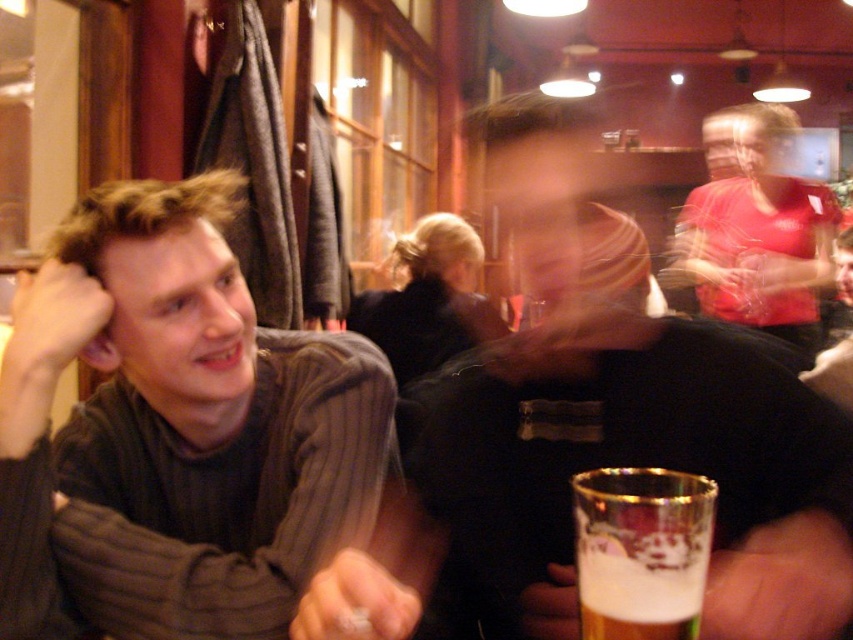
Question: Does black matte shirt at center appear on the left side of foamy glass at lower center?

Choices:
 (A) yes
 (B) no

Answer: (A)

Question: Which object is the closest to the foamy glass at lower center?

Choices:
 (A) dark gray ribbed sweater at left
 (B) matte red shirt at upper right

Answer: (A)

Question: Does dark gray ribbed sweater at left appear on the left side of matte red shirt at upper right?

Choices:
 (A) no
 (B) yes

Answer: (B)

Question: Which object appears farthest from the camera in this image?

Choices:
 (A) black matte shirt at center
 (B) foamy glass at lower center
 (C) dark gray ribbed sweater at left
 (D) matte red shirt at upper right

Answer: (D)

Question: Which point is closer to the camera?

Choices:
 (A) (585, 403)
 (B) (732, 244)
 (C) (592, 556)
 (D) (91, 205)

Answer: (C)

Question: Can you confirm if dark gray ribbed sweater at left is positioned to the right of matte red shirt at upper right?

Choices:
 (A) no
 (B) yes

Answer: (A)